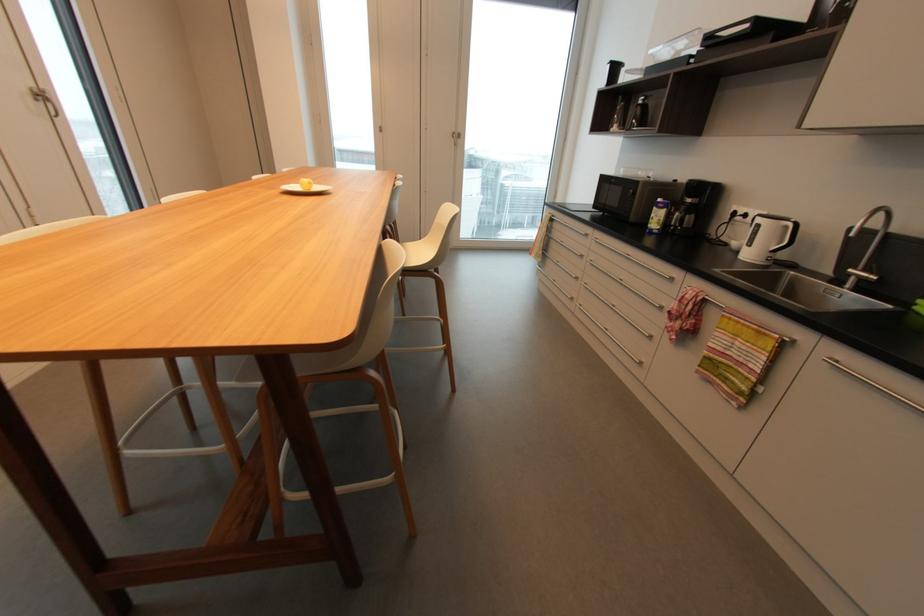
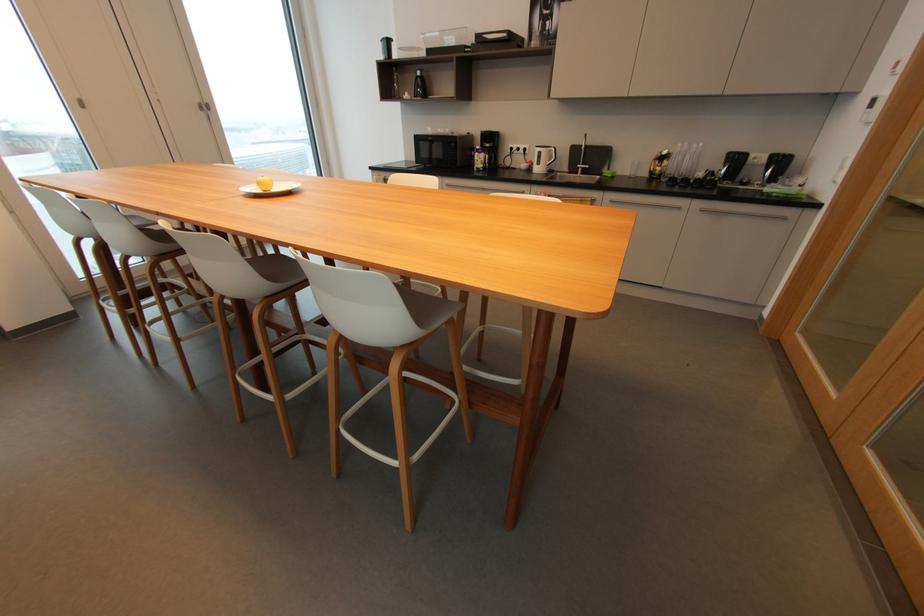
Find the pixel in the second image that matches pixel 383 130 in the first image.

(81, 103)